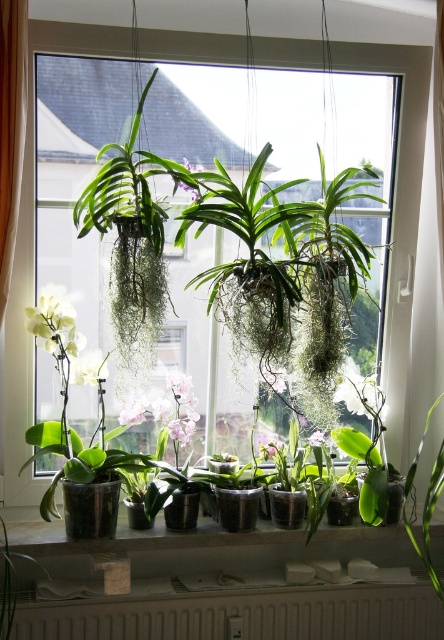
Looking at this image, can you confirm if white plastic radiator at lower center is smaller than purple matte orchid at center?

Incorrect, white plastic radiator at lower center is not smaller in size than purple matte orchid at center.

Is point (428, 588) farther from viewer compared to point (195, 193)?

That is True.

The image size is (444, 640). In order to click on white plastic radiator at lower center in this screenshot , I will do [241, 614].

Between point (99, 100) and point (309, 611), which one is positioned behind?

Positioned behind is point (99, 100).

Is transparent glass window at center to the right of white plastic radiator at lower center from the viewer's perspective?

No, transparent glass window at center is not to the right of white plastic radiator at lower center.

The image size is (444, 640). Find the location of `transparent glass window at center`. transparent glass window at center is located at coordinates (225, 218).

Does white matte orchid at left have a larger size compared to white matte orchid at center?

Correct, white matte orchid at left is larger in size than white matte orchid at center.

Between white matte orchid at left and white matte orchid at center, which one appears on the right side from the viewer's perspective?

white matte orchid at center

Locate an element on the screen. Image resolution: width=444 pixels, height=640 pixels. white matte orchid at left is located at coordinates (63, 339).